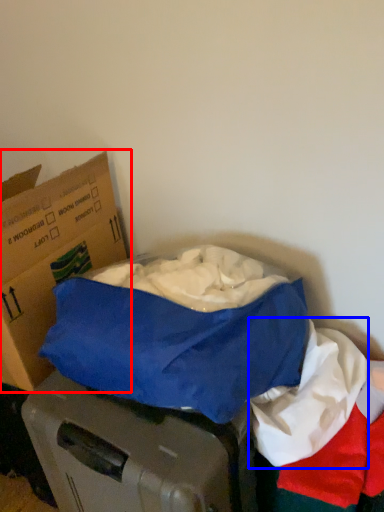
Question: Among these objects, which one is farthest to the camera, box (highlighted by a red box) or linen (highlighted by a blue box)?

Choices:
 (A) box
 (B) linen

Answer: (A)